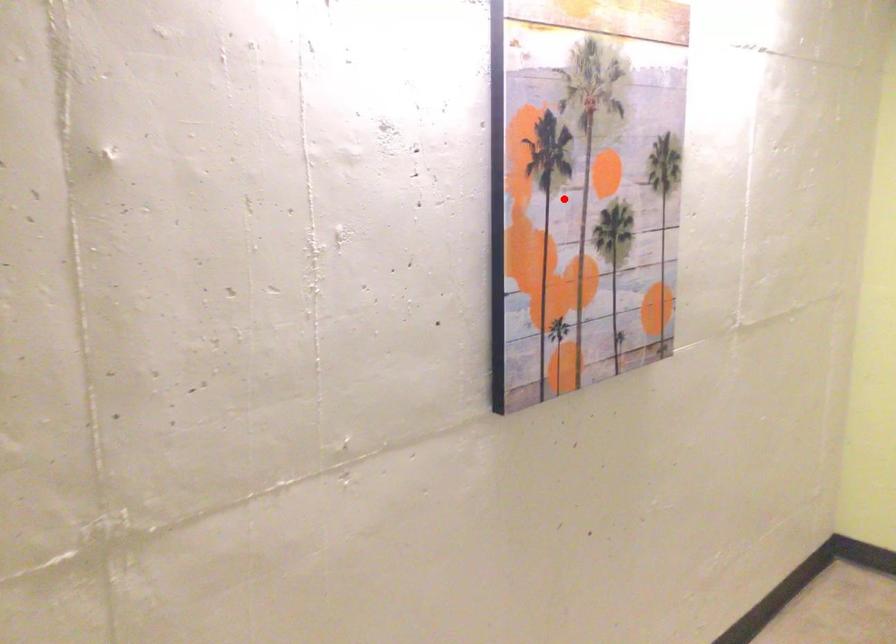
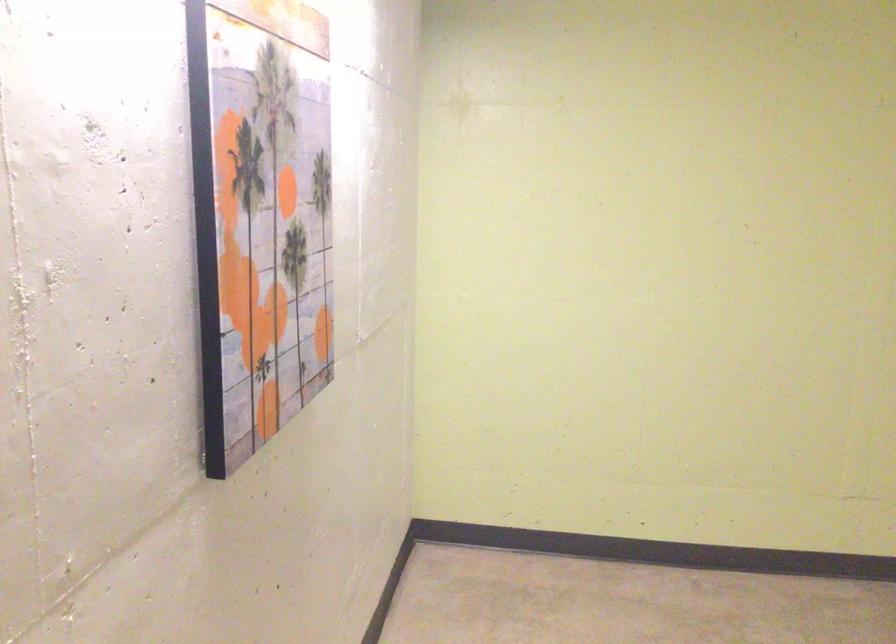
Where in the second image is the point corresponding to the highlighted location from the first image?

(260, 216)